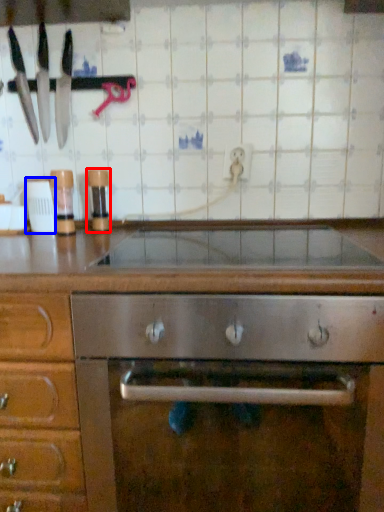
Question: Which point is closer to the camera, appliance (highlighted by a red box) or appliance (highlighted by a blue box)?

Choices:
 (A) appliance
 (B) appliance

Answer: (B)